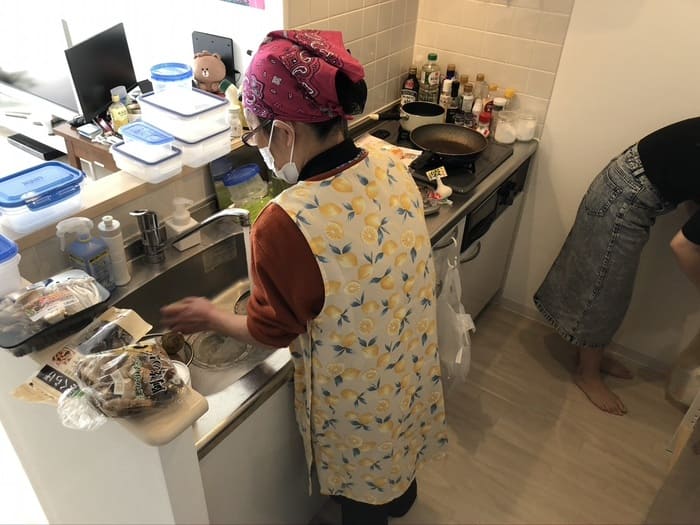
Locate an element on the screen. sink is located at coordinates (218, 292).